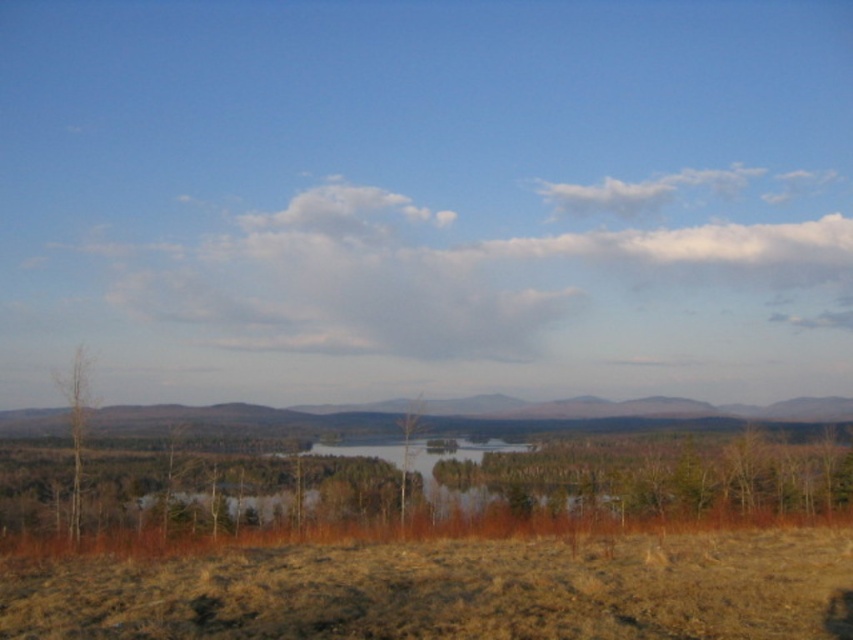
You are standing at the edge of the lake and see the clear water at center and the brown rough tree at center. Which object is positioned to the right of the other?

The clear water at center is to the right of the brown rough tree at center.

You are standing at the center of the image and want to find the clear water at center. In which direction should you look to locate it?

The clear water at center is located at point coordinates, so you should look straight ahead since it is at the center of the image.

Looking at this image, you are standing on a path near the clear water at center and the brown rough tree at center. If you look upward, which object will you see first?

The brown rough tree at center will be seen first when looking upward because it is positioned above the clear water at center.